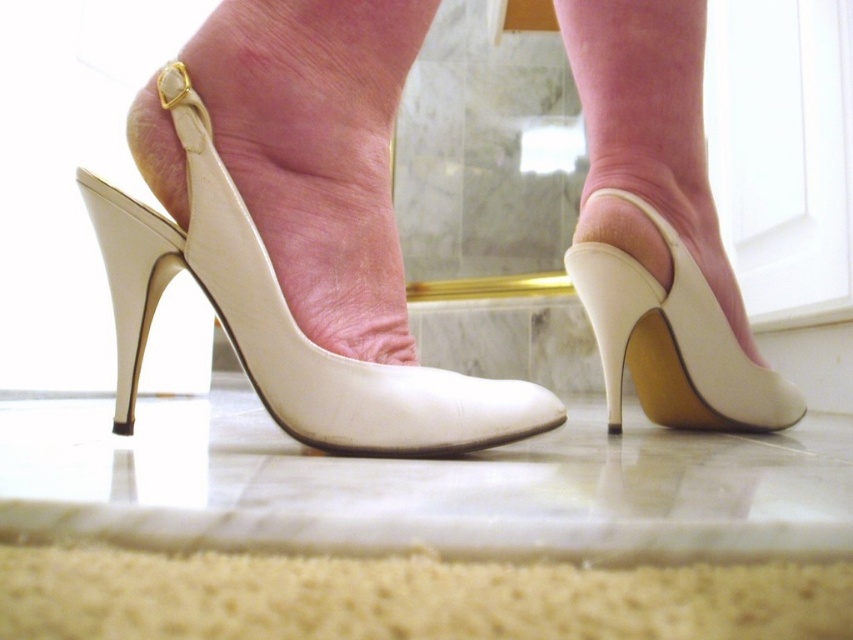
Question: Can you confirm if white leather shoe at center is thinner than white leather high heel at center?

Choices:
 (A) yes
 (B) no

Answer: (B)

Question: From the image, what is the correct spatial relationship of white leather shoe at center in relation to white leather high heel at center?

Choices:
 (A) right
 (B) left

Answer: (B)

Question: Which of the following is the closest to the observer?

Choices:
 (A) (190, 109)
 (B) (699, 292)

Answer: (A)

Question: Does white leather shoe at center lie behind white leather high heel at center?

Choices:
 (A) no
 (B) yes

Answer: (A)